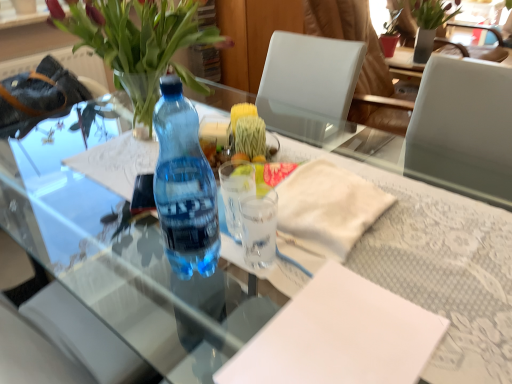
Identify the location of empty space that is ontop of white paper at center, the first notepad when ordered from bottom to top (from a real-world perspective). This screenshot has height=384, width=512. (340, 330).